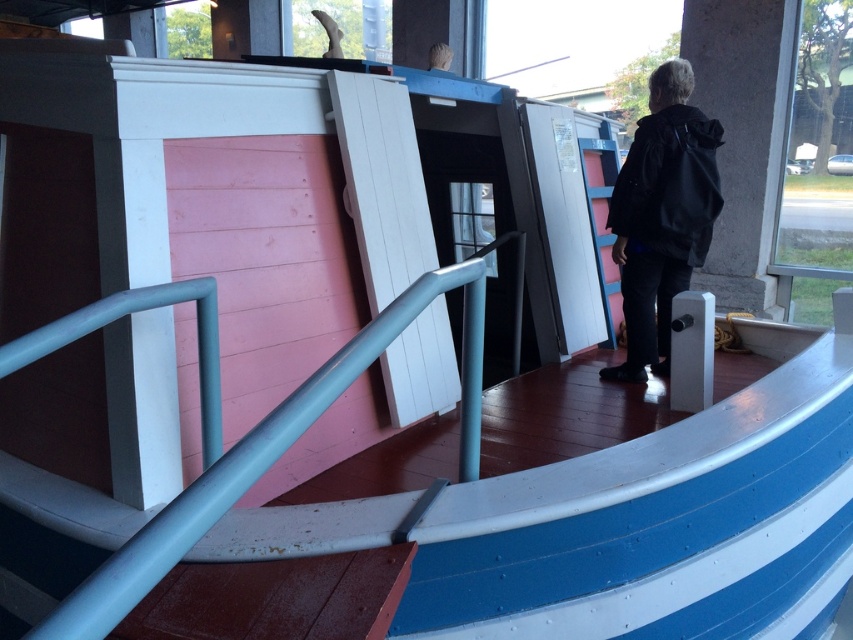
You are on a tour of a boat exhibit and notice a gray concrete pillar at right and a black matte jacket at center. Which object is closer to the front of the boat?

The gray concrete pillar at right is closer to the front of the boat because the black matte jacket at center is behind it.